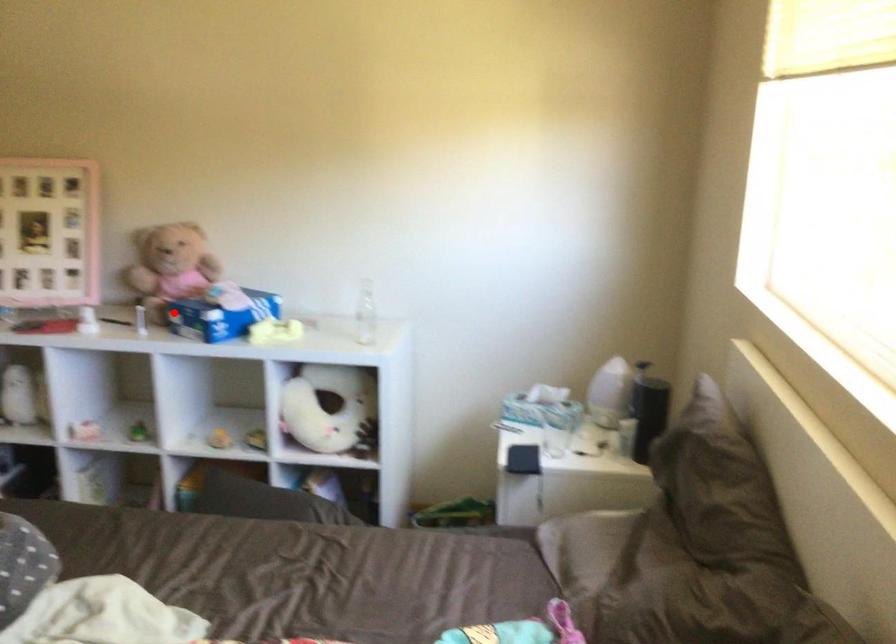
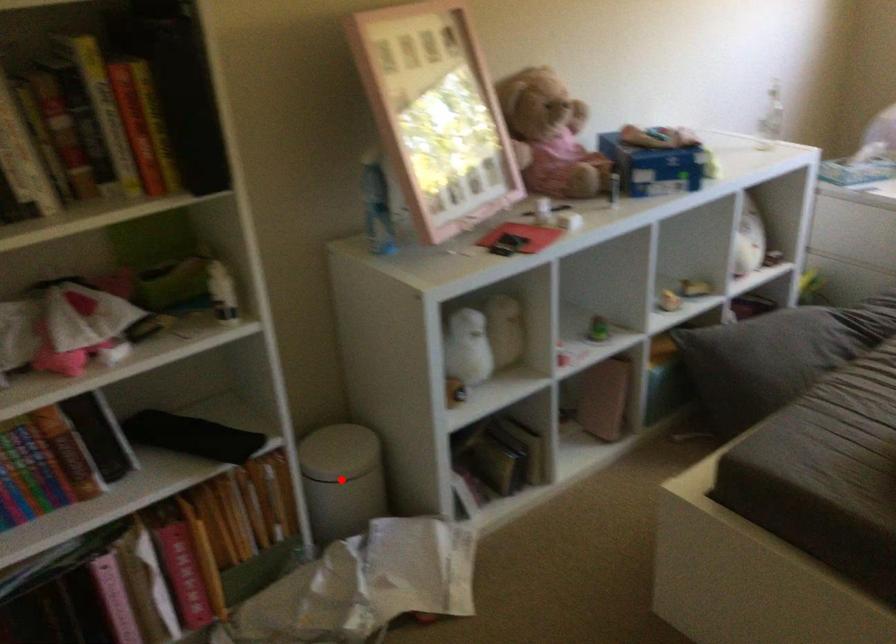
I am providing you with two images of the same scene from different viewpoints. A red point is marked on the first image and another point is marked on the second image. Is the marked point in image1 the same physical position as the marked point in image2?

No